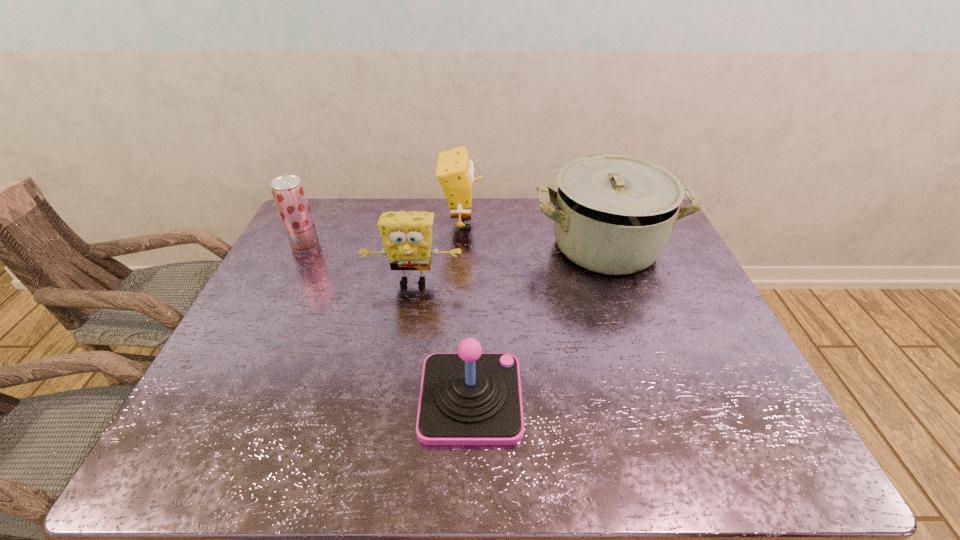
The image size is (960, 540). What are the coordinates of `the farther sponge` in the screenshot? It's located at (455, 171).

Locate an element on the screen. saucepan is located at coordinates (614, 214).

You are a GUI agent. You are given a task and a screenshot of the screen. Output one action in this format:
    pyautogui.click(x=<x>, y=<y>)
    Task: Click on the leftmost object
    This screenshot has height=540, width=960.
    Given the screenshot: What is the action you would take?
    pyautogui.click(x=288, y=191)

Find the location of a particular element. the nearer sponge is located at coordinates (407, 236).

This screenshot has height=540, width=960. What are the coordinates of `joystick` in the screenshot? It's located at (467, 398).

Find the location of a particular element. This screenshot has height=540, width=960. the nearest object is located at coordinates coord(467,398).

The width and height of the screenshot is (960, 540). In order to click on vacant space located 0.050m on the face of the farther sponge in this screenshot , I will do `click(496, 222)`.

Identify the location of vacant space located 0.060m on the left of the rightmost object. (515, 246).

The image size is (960, 540). I want to click on free point located on the right of the leftmost object, so pos(350,246).

Identify the location of vacant region located on the face of the nearer sponge. (397, 374).